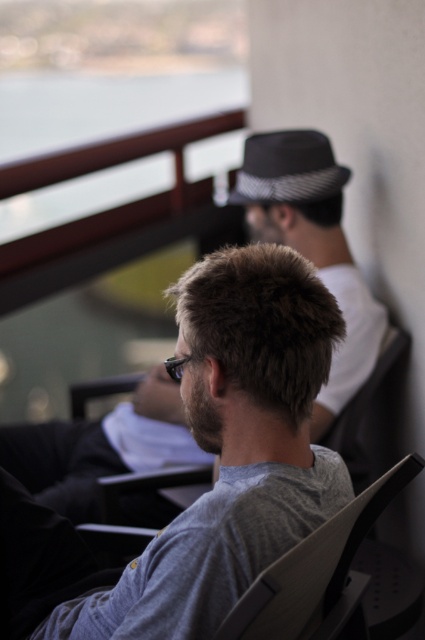
You are a photographer trying to capture a clear shot of both the gray matte shirt at center and the gray woolen hat at upper right. Based on their positions, which object should you focus on first to ensure both are in frame?

The gray matte shirt at center is positioned under gray woolen hat at upper right, so focusing on the gray woolen hat at upper right first would allow the gray matte shirt at center to naturally fall into the frame below it.

You are a photographer adjusting your camera settings to focus on the gray matte shirt at center and the gray matte sunglasses at center. Which object should you adjust your focus to first if you want to capture both clearly in the same frame?

The gray matte shirt at center is much taller than the gray matte sunglasses at center, so you should focus on the gray matte shirt at center first to ensure it is in clear focus before adjusting for the sunglasses.